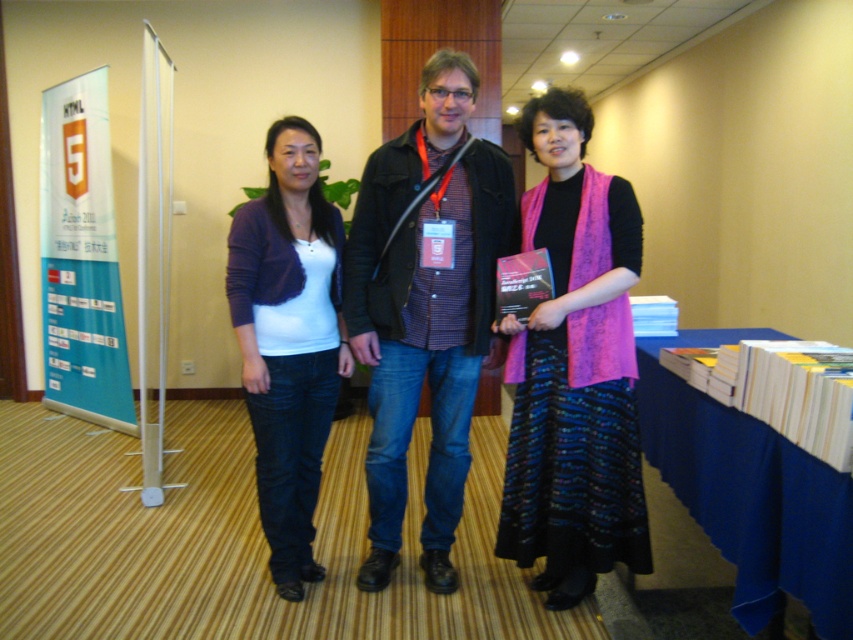
Question: Estimate the real-world distances between objects in this image. Which object is farther from the pink knitted scarf at center?

Choices:
 (A) matte black jacket at center
 (B) matte purple cardigan at center
 (C) blue fabric table at lower right

Answer: (B)

Question: Estimate the real-world distances between objects in this image. Which object is farther from the pink knitted scarf at center?

Choices:
 (A) matte black jacket at center
 (B) matte purple cardigan at center

Answer: (B)

Question: Is matte black jacket at center further to the viewer compared to blue fabric table at lower right?

Choices:
 (A) no
 (B) yes

Answer: (B)

Question: Which object appears closest to the camera in this image?

Choices:
 (A) matte purple cardigan at center
 (B) blue fabric table at lower right
 (C) matte black jacket at center
 (D) pink knitted scarf at center

Answer: (B)

Question: Does matte purple cardigan at center have a lesser width compared to blue fabric table at lower right?

Choices:
 (A) no
 (B) yes

Answer: (B)

Question: Is the position of matte black jacket at center less distant than that of blue fabric table at lower right?

Choices:
 (A) no
 (B) yes

Answer: (A)